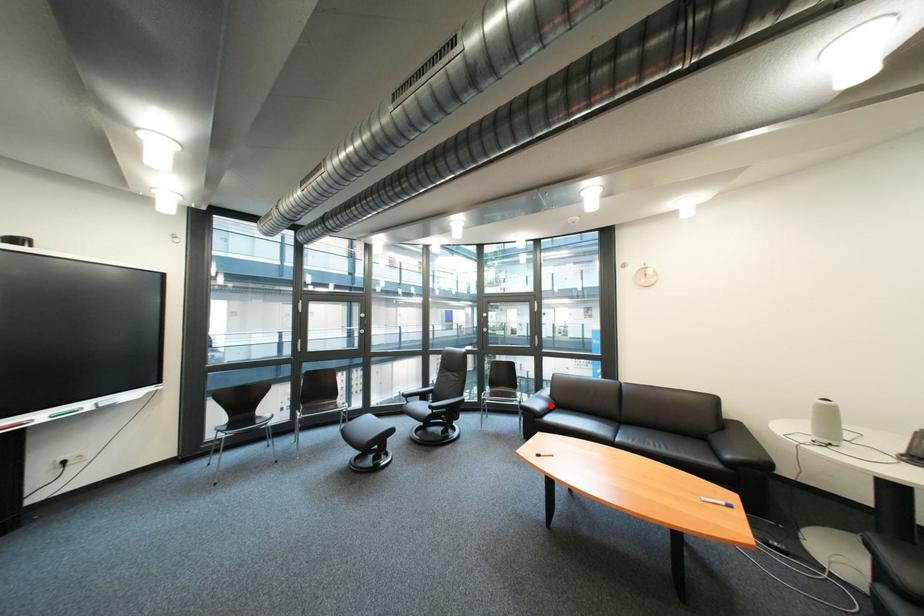
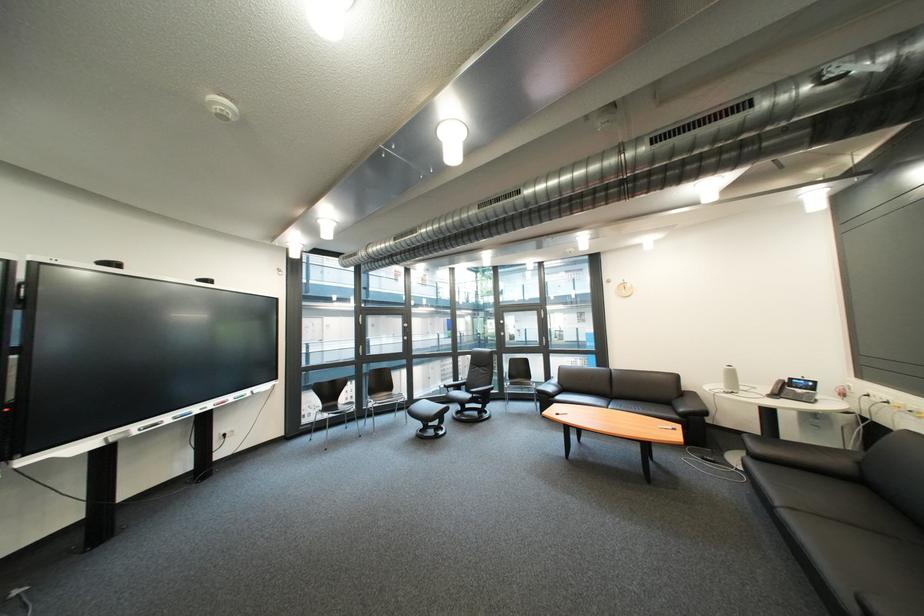
Find the pixel in the second image that matches the highlighted location in the first image.

(563, 389)